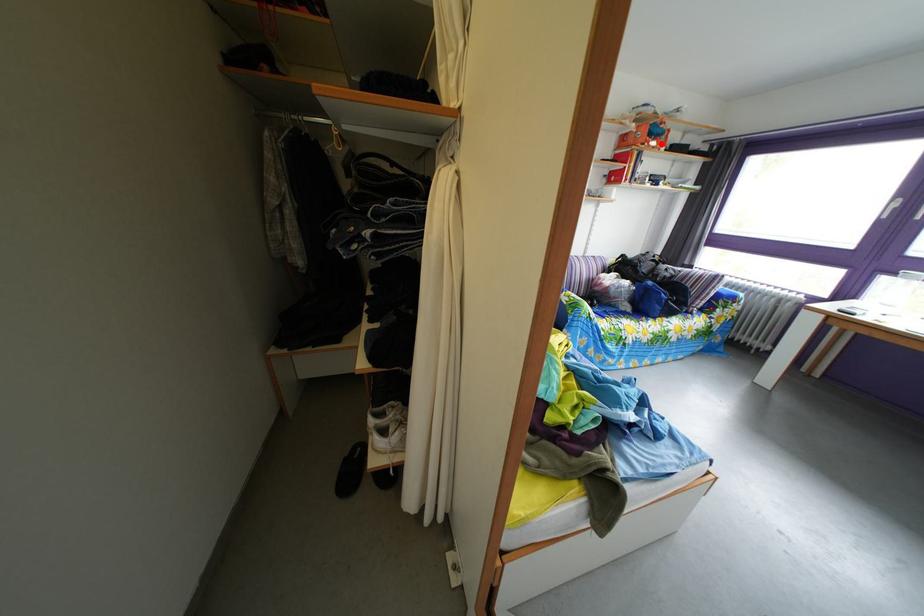
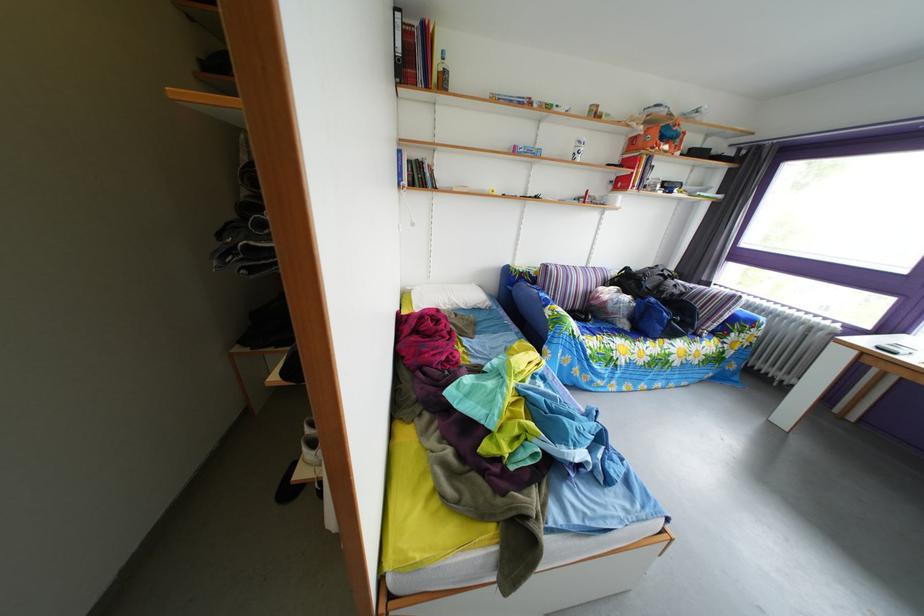
Locate, in the second image, the point that corresponds to the highlighted location in the first image.

(673, 147)